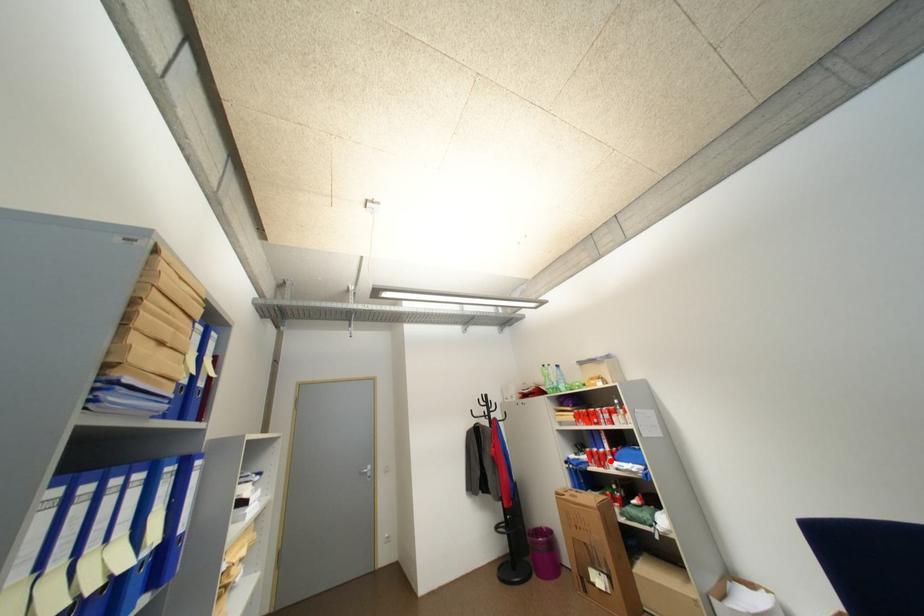
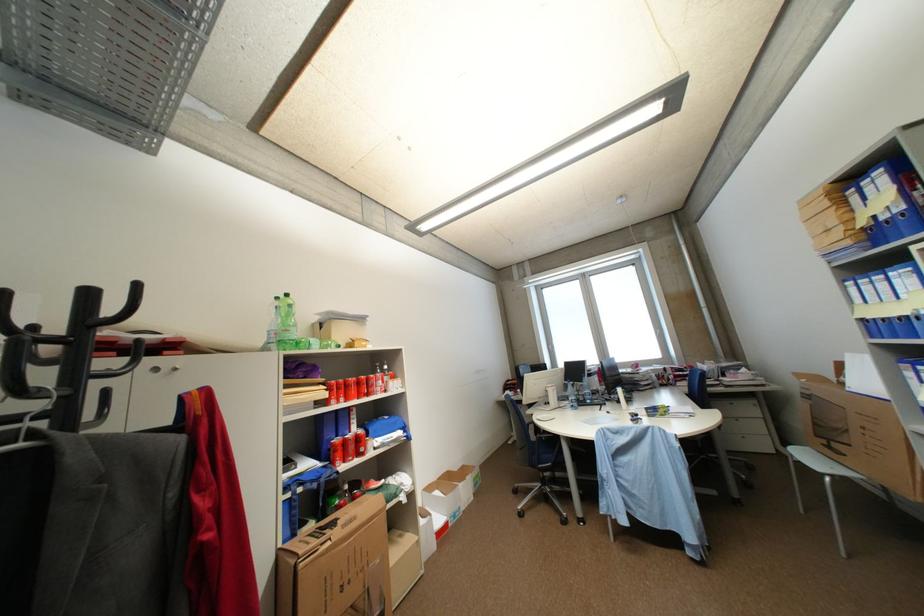
The point at the highlighted location is marked in the first image. Where is the corresponding point in the second image?

(368, 447)